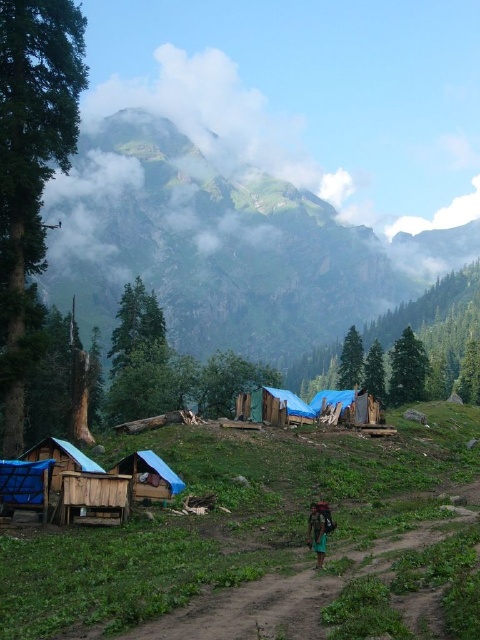
In the scene shown: You are a hiker who has just arrived at this mountain area and needs to decide where to place your gear. You have a green fabric bag at lower center and a wooden hut at lower left. Based on their sizes, which item can accommodate more items?

The wooden hut at lower left can accommodate more items because its width surpasses that of the green fabric bag at lower center.

You are a hiker who just arrived at this mountain area and need to set up your gear. You have a blue tarpaulin tent at center and a green fabric bag at lower center. Which object should you place first if you want to set up your items starting from the left side of the area?

You should place the blue tarpaulin tent at center first because it is positioned on the left side of the green fabric bag at lower center, so starting from the left, you would set up the blue tarpaulin tent at center first.

You are a hiker who has just arrived at the campsite and need to set up your gear. You have a blue tarpaulin tent at lower center and a green fabric bag at lower center. Which object is positioned to the left side of the other?

The blue tarpaulin tent at lower center is to the left of the green fabric bag at lower center.